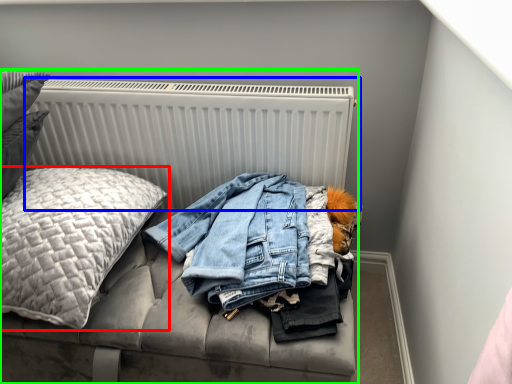
Question: Which object is positioned closest to pillow (highlighted by a red box)? Select from radiator (highlighted by a blue box) and furniture (highlighted by a green box).

Choices:
 (A) radiator
 (B) furniture

Answer: (A)